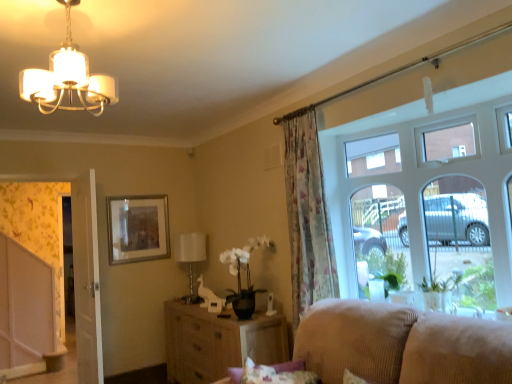
Question: Which direction should I rotate to face white fabric lampshade at center, which appears as the 2th lamp when viewed from the top, — up or down?

Choices:
 (A) up
 (B) down

Answer: (B)

Question: Considering the relative positions of floral fabric curtain at center and silver metallic picture frame at upper center in the image provided, is floral fabric curtain at center to the left of silver metallic picture frame at upper center from the viewer's perspective?

Choices:
 (A) no
 (B) yes

Answer: (A)

Question: Is floral fabric curtain at center to the right of silver metallic picture frame at upper center from the viewer's perspective?

Choices:
 (A) no
 (B) yes

Answer: (B)

Question: Is floral fabric curtain at center thinner than silver metallic picture frame at upper center?

Choices:
 (A) no
 (B) yes

Answer: (A)

Question: Can we say floral fabric curtain at center lies outside silver metallic picture frame at upper center?

Choices:
 (A) yes
 (B) no

Answer: (A)

Question: Does floral fabric curtain at center come behind silver metallic picture frame at upper center?

Choices:
 (A) yes
 (B) no

Answer: (B)

Question: Does floral fabric curtain at center turn towards silver metallic picture frame at upper center?

Choices:
 (A) yes
 (B) no

Answer: (B)

Question: Is white fabric lampshade at center, which appears as the 2th lamp when viewed from the top, completely or partially outside of woven wood cabinet at center?

Choices:
 (A) no
 (B) yes

Answer: (B)

Question: Is white fabric lampshade at center, which ranks as the first lamp in back-to-front order, positioned far away from woven wood cabinet at center?

Choices:
 (A) no
 (B) yes

Answer: (A)

Question: Is white fabric lampshade at center, arranged as the 1th lamp when ordered from the bottom, bigger than woven wood cabinet at center?

Choices:
 (A) yes
 (B) no

Answer: (B)

Question: From the image's perspective, is white fabric lampshade at center, placed as the 2th lamp when sorted from front to back, below woven wood cabinet at center?

Choices:
 (A) no
 (B) yes

Answer: (A)

Question: Is white fabric lampshade at center, which ranks as the first lamp in back-to-front order, aimed at woven wood cabinet at center?

Choices:
 (A) no
 (B) yes

Answer: (A)

Question: From a real-world perspective, is white fabric lampshade at center, which ranks as the first lamp in back-to-front order, on woven wood cabinet at center?

Choices:
 (A) yes
 (B) no

Answer: (A)

Question: Can you confirm if floral fabric curtain at center is bigger than woven wood cabinet at center?

Choices:
 (A) yes
 (B) no

Answer: (B)